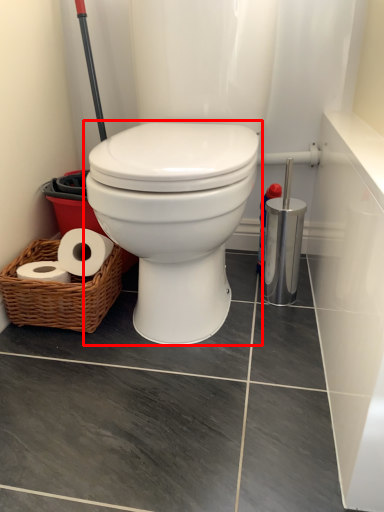
Question: Considering the relative positions of toilet (annotated by the red box) and basket in the image provided, where is toilet (annotated by the red box) located with respect to the staircase?

Choices:
 (A) left
 (B) right

Answer: (B)